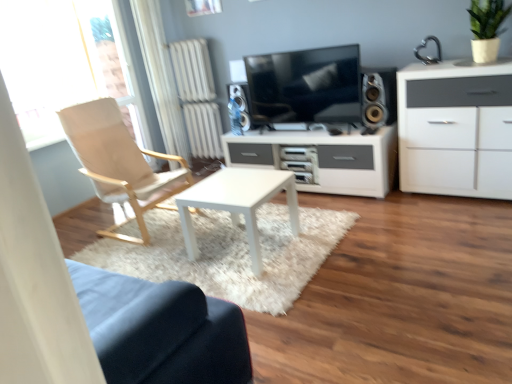
Find the location of a particular element. This screenshot has height=384, width=512. free point below transparent glass window at upper left (from a real-world perspective) is located at coordinates (72, 205).